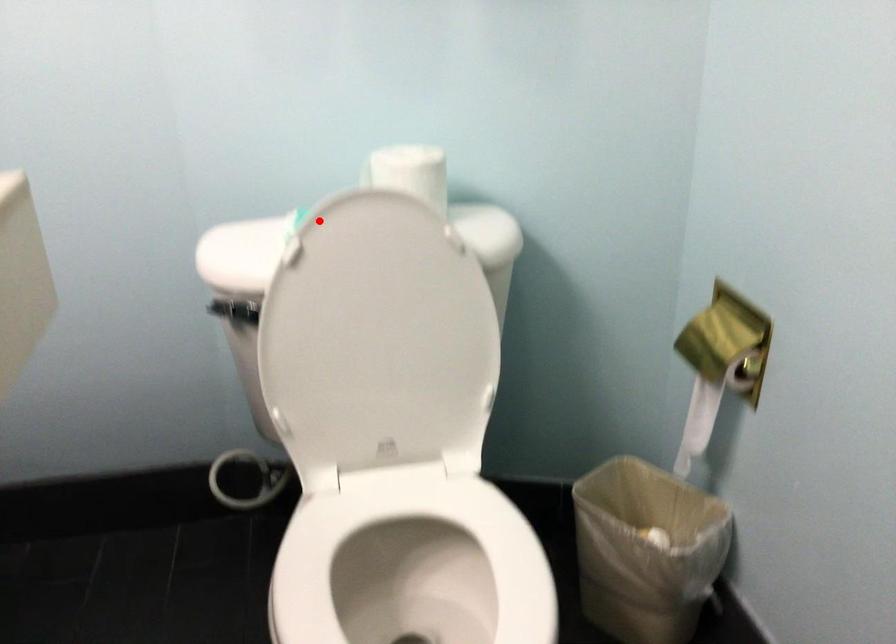
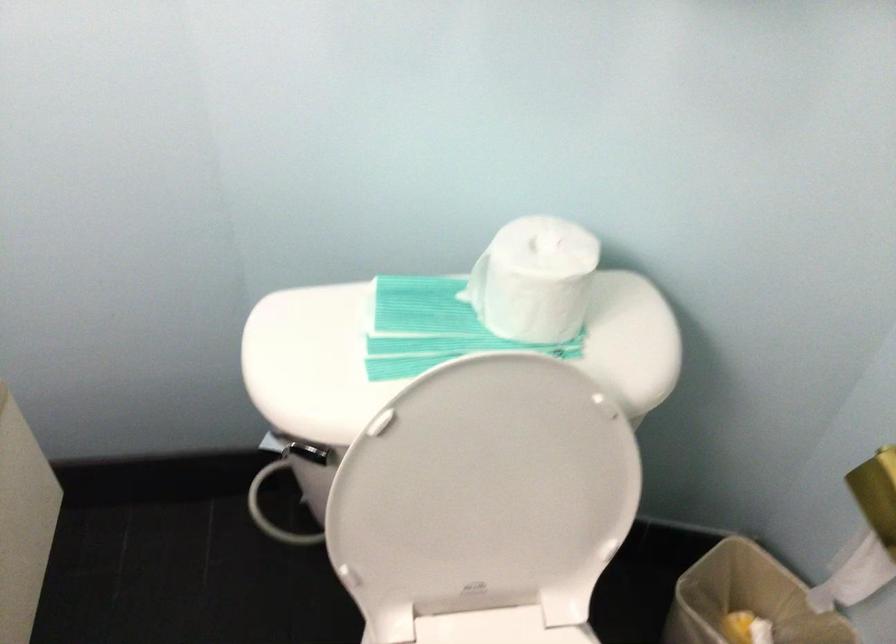
Find the pixel in the second image that matches the highlighted location in the first image.

(415, 308)